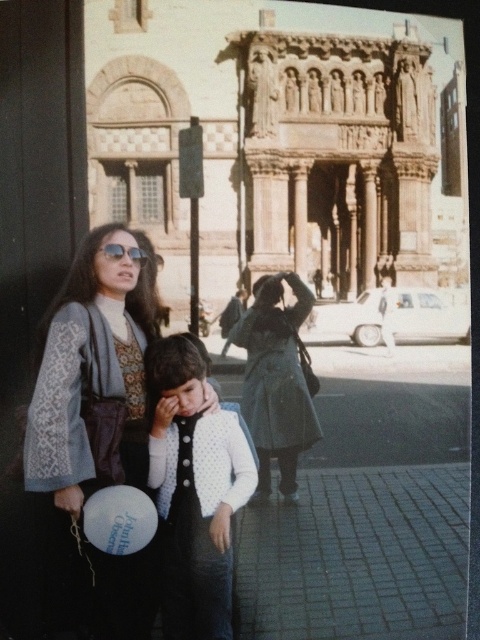
Question: Which object appears farthest from the camera in this image?

Choices:
 (A) dark gray wool coat at center
 (B) matte gray sweater at left

Answer: (A)

Question: Which point appears closest to the camera in this image?

Choices:
 (A) (70, 538)
 (B) (282, 346)
 (C) (200, 540)

Answer: (A)

Question: Is matte gray sweater at left thinner than dark gray wool coat at center?

Choices:
 (A) no
 (B) yes

Answer: (A)

Question: Which point is farther to the camera?

Choices:
 (A) matte black sunglasses at upper left
 (B) white dotted cardigan at center
 (C) dark gray wool coat at center
 (D) matte gray sweater at left

Answer: (C)

Question: Does white dotted cardigan at center have a lesser width compared to dark gray wool coat at center?

Choices:
 (A) no
 (B) yes

Answer: (A)

Question: Can you confirm if matte gray sweater at left is wider than white dotted cardigan at center?

Choices:
 (A) yes
 (B) no

Answer: (A)